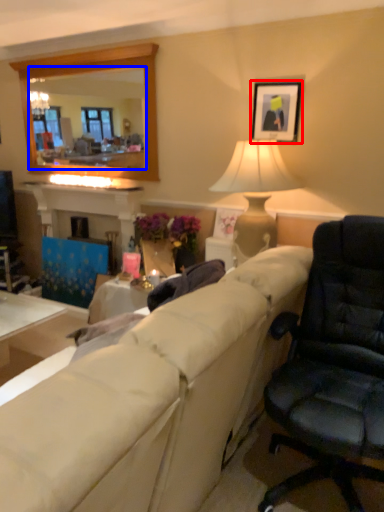
Question: Which object appears closest to the camera in this image, picture frame (highlighted by a red box) or mirror (highlighted by a blue box)?

Choices:
 (A) picture frame
 (B) mirror

Answer: (A)